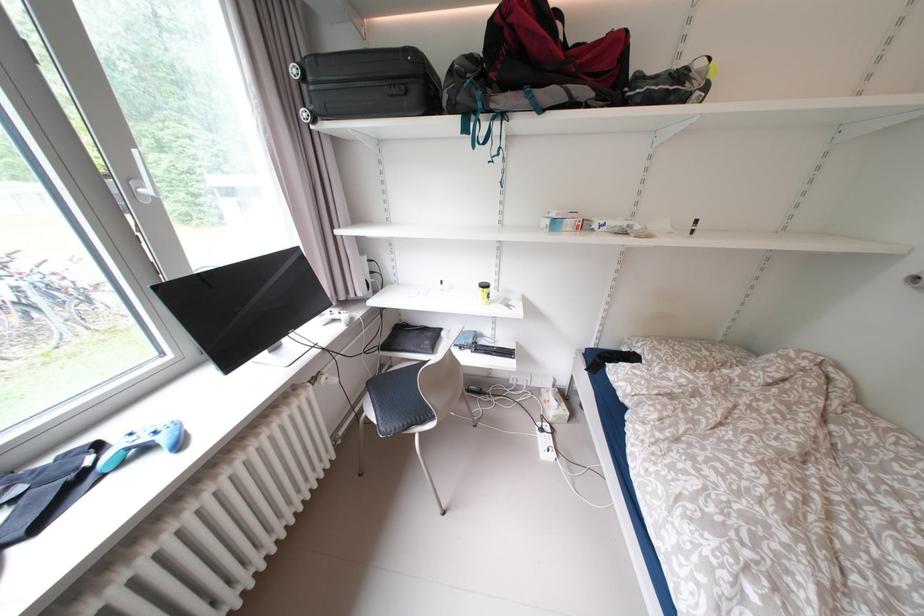
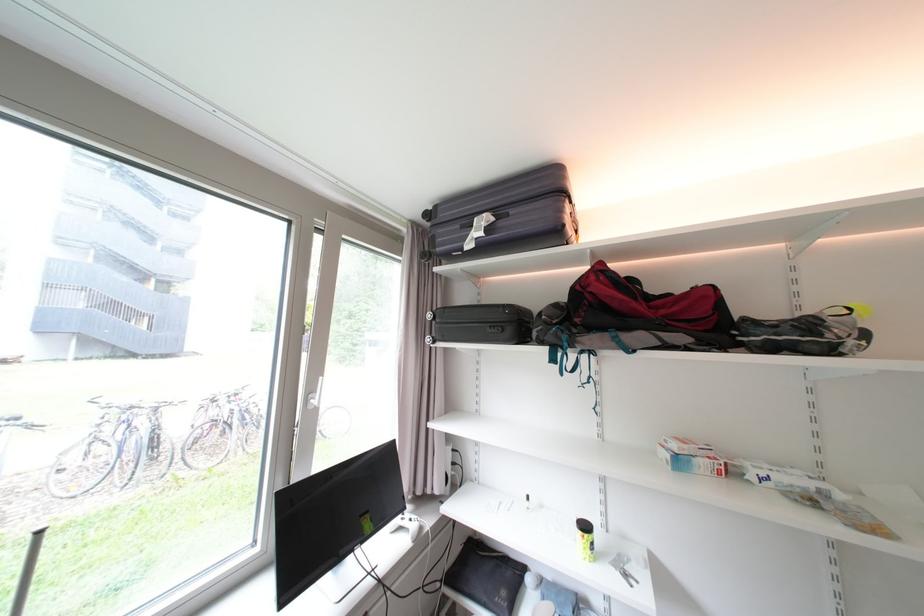
Locate, in the second image, the point that corresponds to point (501, 76) in the first image.

(585, 322)